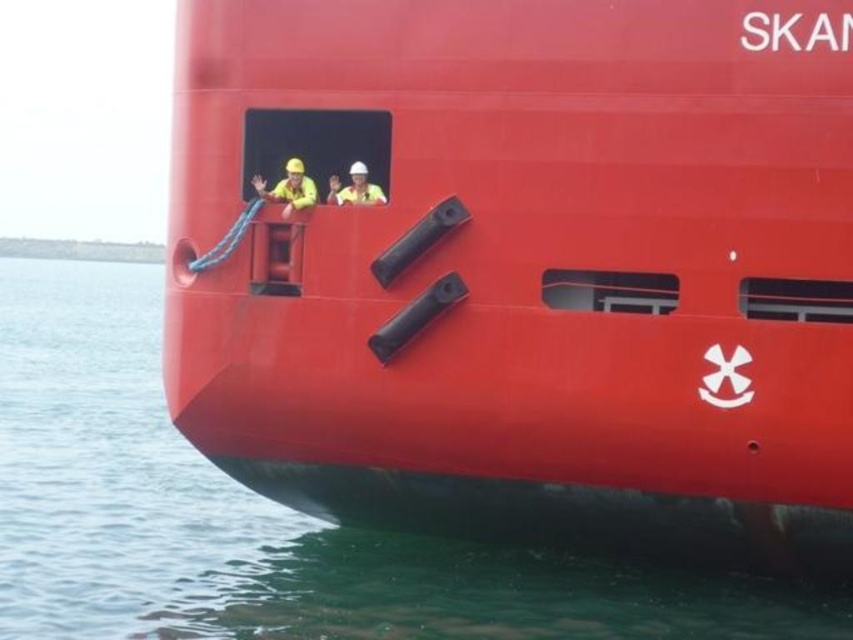
Question: Does smooth red ship at center appear under green water at lower left?

Choices:
 (A) yes
 (B) no

Answer: (B)

Question: Does smooth red ship at center have a larger size compared to green water at lower left?

Choices:
 (A) no
 (B) yes

Answer: (A)

Question: Which of the following is the farthest from the observer?

Choices:
 (A) (776, 240)
 (B) (64, 456)

Answer: (B)

Question: Does smooth red ship at center have a smaller size compared to green water at lower left?

Choices:
 (A) yes
 (B) no

Answer: (A)